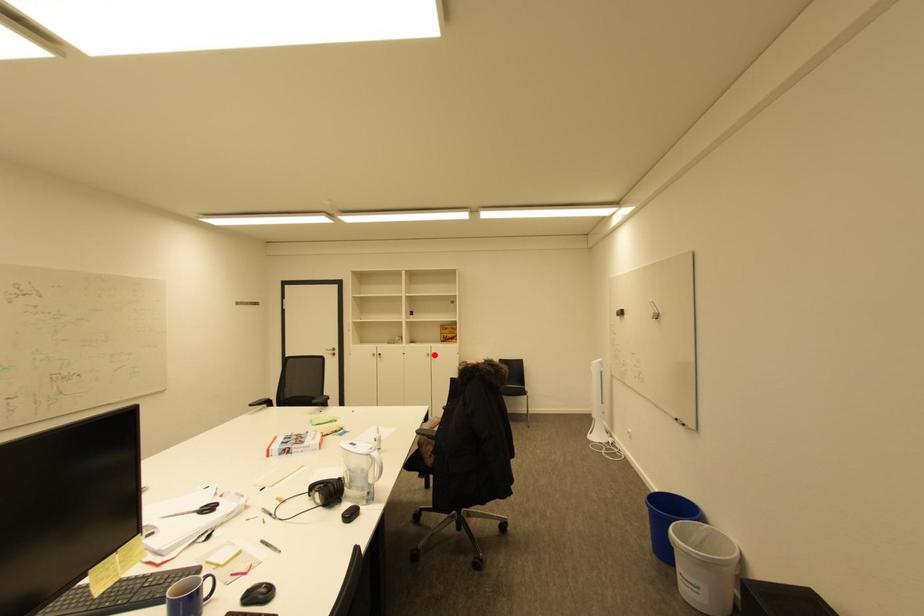
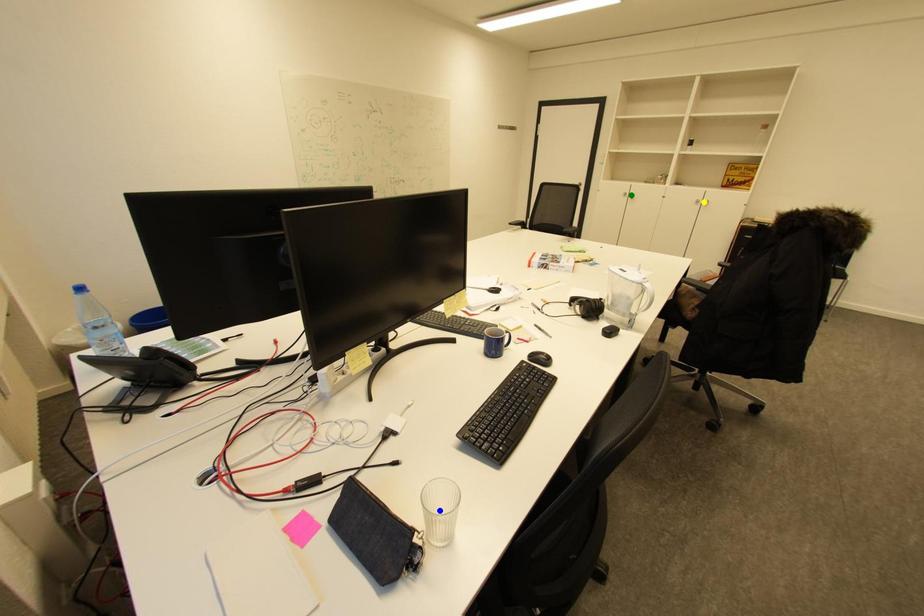
Question: I am providing you with two images of the same scene from different viewpoints. A red point is marked on the first image. You are given multiple points on the second image. Which point in image 2 represents the same 3d spot as the red point in image 1?

Choices:
 (A) green point
 (B) blue point
 (C) yellow point

Answer: (C)